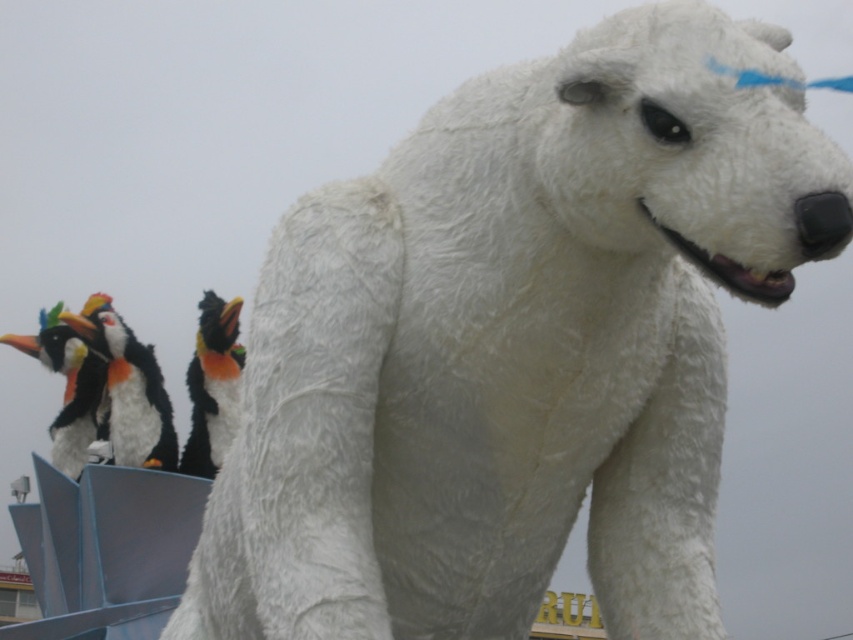
Is black and orange feathers at left smaller than black plush penguin at left?

Yes.

Who is more distant from viewer, (212, 396) or (64, 404)?

The point (64, 404) is more distant.

Find the location of a particular element. The image size is (853, 640). black and orange feathers at left is located at coordinates (213, 385).

Does fluffy white penguin at left have a larger size compared to black and orange feathers at left?

Yes, fluffy white penguin at left is bigger than black and orange feathers at left.

Looking at this image, is fluffy white penguin at left smaller than black and orange feathers at left?

No.

The image size is (853, 640). In order to click on fluffy white penguin at left in this screenshot , I will do `click(126, 388)`.

Does point (111, 385) come closer to viewer compared to point (78, 346)?

That is True.

Where is `fluffy white penguin at left`? The height and width of the screenshot is (640, 853). fluffy white penguin at left is located at coordinates point(126,388).